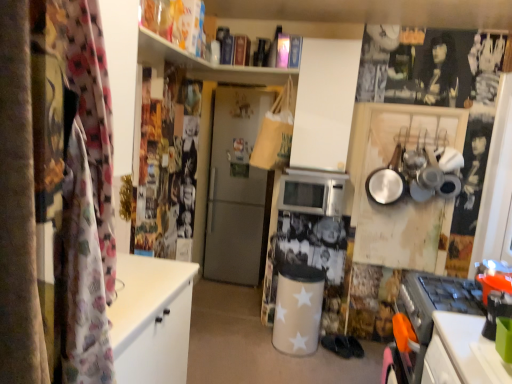
Question: From the image's perspective, is black fabric shoe at center located above or below satin silver refrigerator at center?

Choices:
 (A) below
 (B) above

Answer: (A)

Question: Considering the positions of point (332, 344) and point (239, 211), is point (332, 344) closer or farther from the camera than point (239, 211)?

Choices:
 (A) closer
 (B) farther

Answer: (A)

Question: Estimate the real-world distances between objects in this image. Which object is farther from the black fabric shoe at center?

Choices:
 (A) silver metallic microwave at center
 (B) satin silver refrigerator at center

Answer: (B)

Question: Which object is the farthest from the silver metallic microwave at center?

Choices:
 (A) satin silver refrigerator at center
 (B) black fabric shoe at center

Answer: (A)